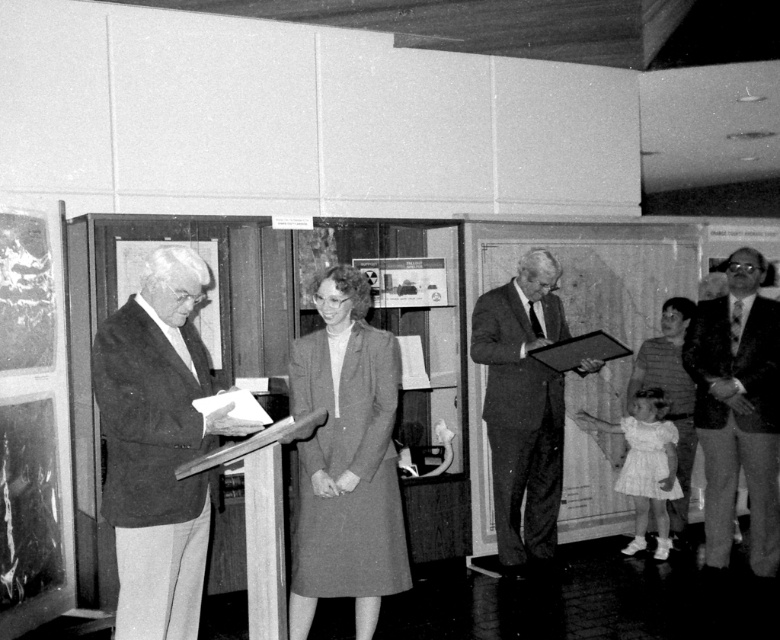
Can you confirm if dark suit at right is smaller than striped fabric dress at lower right?

No, dark suit at right is not smaller than striped fabric dress at lower right.

Who is shorter, dark suit at right or striped fabric dress at lower right?

Standing shorter between the two is striped fabric dress at lower right.

Between point (732, 384) and point (676, 508), which one is positioned in front?

Point (732, 384)

Locate an element on the screen. This screenshot has width=780, height=640. dark suit at right is located at coordinates (736, 410).

Can you confirm if suit at center is positioned to the left of dark suit at right?

Yes, suit at center is to the left of dark suit at right.

Which is behind, point (559, 413) or point (725, 429)?

Point (559, 413)

At what (x,y) coordinates should I click in order to perform the action: click on suit at center. Please return your answer as a coordinate pair (x, y). Image resolution: width=780 pixels, height=640 pixels. Looking at the image, I should click on (523, 410).

Can you confirm if matte gray coat at center is positioned above dark suit at right?

Actually, matte gray coat at center is below dark suit at right.

Does matte gray coat at center have a larger size compared to dark suit at right?

No.

Locate an element on the screen. The width and height of the screenshot is (780, 640). matte gray coat at center is located at coordinates (346, 460).

Find the location of a particular element. The height and width of the screenshot is (640, 780). matte gray coat at center is located at coordinates (346, 460).